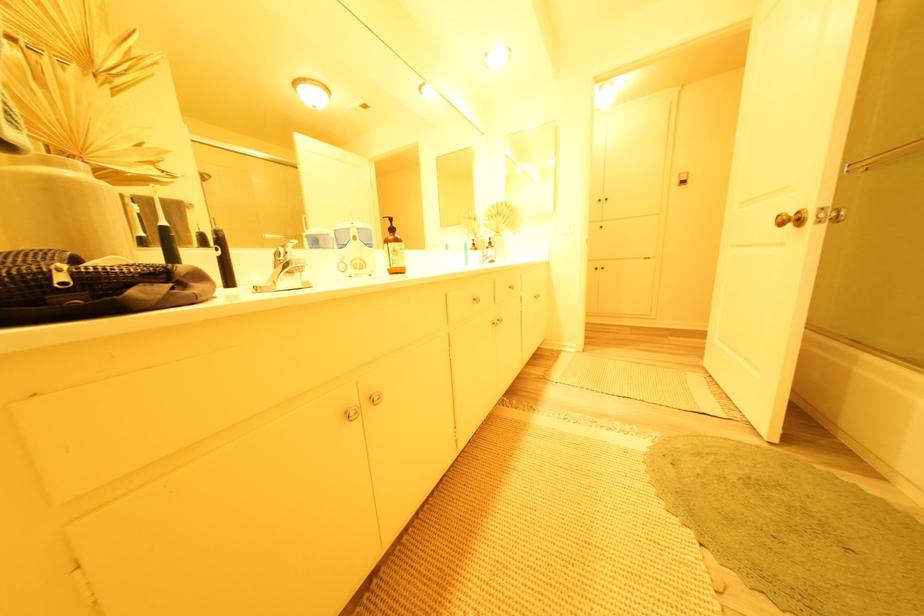
Locate an element on the screen. white light switch is located at coordinates (563, 227).